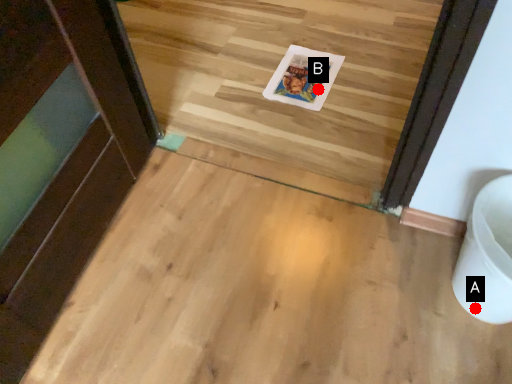
Question: Two points are circled on the image, labeled by A and B beside each circle. Which point is closer to the camera taking this photo?

Choices:
 (A) A is closer
 (B) B is closer

Answer: (A)